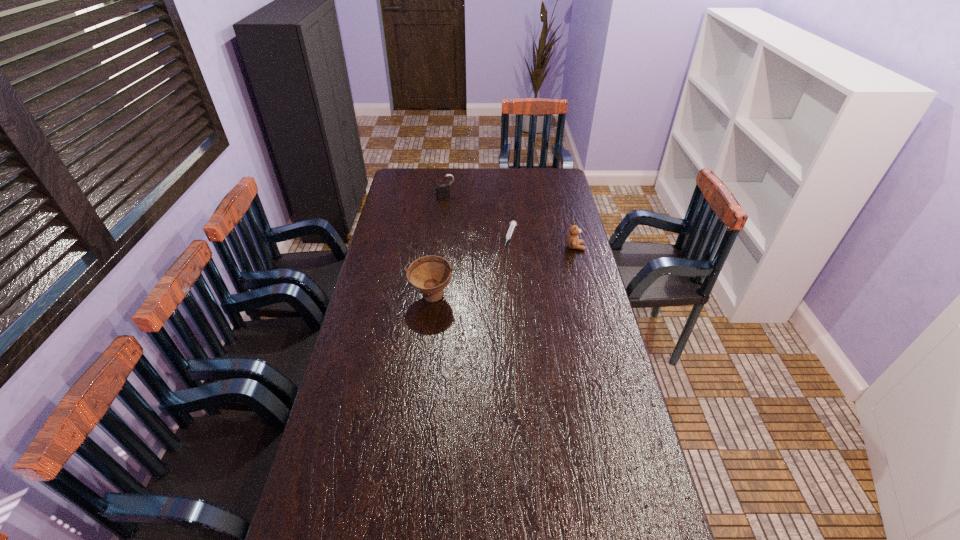
You are a GUI agent. You are given a task and a screenshot of the screen. Output one action in this format:
    pyautogui.click(x=<x>, y=<y>)
    Task: Click on the free space located with the keyhole on the front of the farthest object
    
    Given the screenshot: What is the action you would take?
    pyautogui.click(x=478, y=242)

The width and height of the screenshot is (960, 540). What are the coordinates of `free space located 0.070m with the keyhole on the front of the farthest object` in the screenshot? It's located at (454, 206).

The width and height of the screenshot is (960, 540). I want to click on free space located 0.050m with the keyhole on the front of the farthest object, so click(452, 204).

Locate an element on the screen. The height and width of the screenshot is (540, 960). object located in the right edge section of the desktop is located at coordinates (573, 242).

In the image, there is a desktop. At what (x,y) coordinates should I click in order to perform the action: click on vacant space at the far edge. Please return your answer as a coordinate pair (x, y). The width and height of the screenshot is (960, 540). Looking at the image, I should click on (491, 184).

This screenshot has width=960, height=540. Find the location of `free region at the near edge`. free region at the near edge is located at coordinates (555, 516).

Locate an element on the screen. The width and height of the screenshot is (960, 540). vacant space at the left edge is located at coordinates (386, 210).

Where is `vacant space at the right edge of the desktop`? Image resolution: width=960 pixels, height=540 pixels. vacant space at the right edge of the desktop is located at coordinates (574, 249).

At what (x,y) coordinates should I click in order to perform the action: click on blank space at the near right corner of the desktop. Please return your answer as a coordinate pair (x, y). The height and width of the screenshot is (540, 960). Looking at the image, I should click on 626,533.

Locate an element on the screen. The width and height of the screenshot is (960, 540). free spot between the third object from left to right and the padlock is located at coordinates (478, 217).